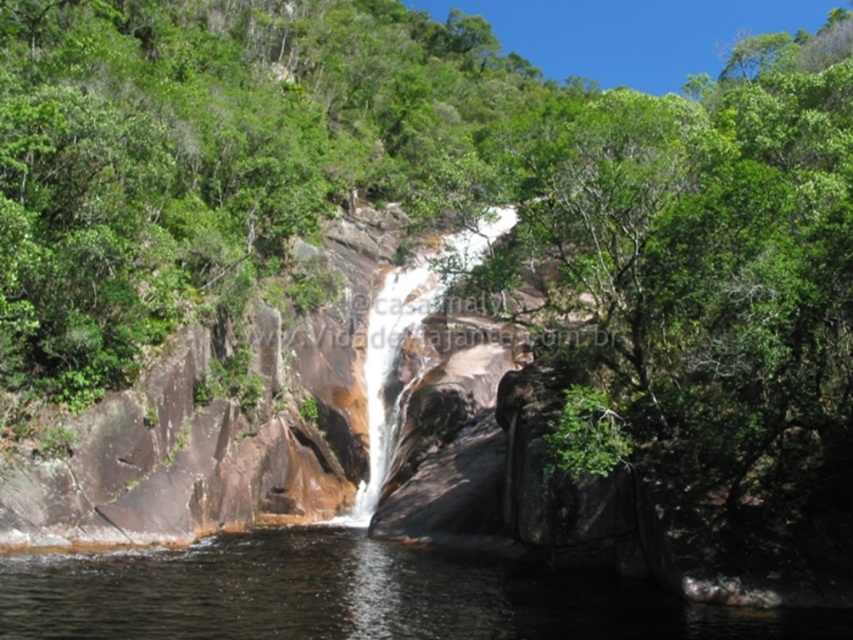
You are standing at point A and want to reach point B. The coordinates of point A are point A at (345, 602) and point B is at 0.554, 0.678. Given that the distance between them is 49.26 meters, can you walk directly from point A to point B without any obstacles?

The distance between point A at (345, 602) and point B at 0.554, 0.678 is 49.26 meters. However, the scene description mentions a waterfall cascading down a rocky cliff and a calm body of water below, which likely creates a natural barrier between the two points. Therefore, you cannot walk directly from point A to point B without encountering obstacles like the waterfall or the water body.

You are standing at the edge of the cliff overlooking the waterfall. There is a point marked at coordinates [354,595]. What can you observe about the location of this point in relation to the waterfall and the surrounding environment?

The point at [354,595] is located at the center where clear water exists, indicating it is likely in the middle of the calm body of water below the waterfall.

You are a hiker who wants to cross the clear water at center. You see the white smooth waterfall at center nearby. Which direction should you go to avoid the falling water?

The clear water at center is located below the white smooth waterfall at center, so to avoid the falling water, you should go upstream away from the white smooth waterfall at center.